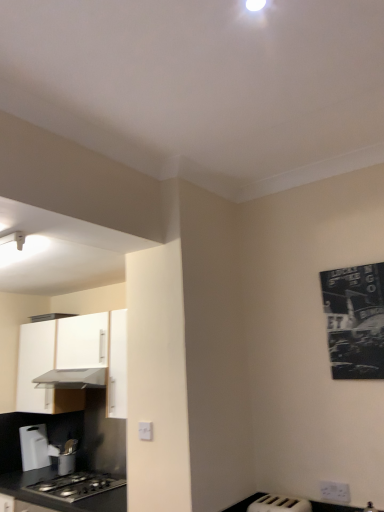
Question: From the image's perspective, is white plastic toaster at lower right, the 2th appliance from the back, positioned above or below white plastic electric outlet at lower right, the first electric outlet in the right-to-left sequence?

Choices:
 (A) above
 (B) below

Answer: (B)

Question: From a real-world perspective, relative to white plastic electric outlet at lower right, which appears as the 2th electric outlet when viewed from the left, is white plastic toaster at lower right, the 1th appliance viewed from the top, vertically above or below?

Choices:
 (A) below
 (B) above

Answer: (A)

Question: Considering the real-world distances, which object is farthest from the black matte countertop at lower left?

Choices:
 (A) white plastic electric outlet at lower right, which is the 1th electric outlet in bottom-to-top order
 (B) metallic silver utensil holder at lower left, which ranks as the 1th appliance in left-to-right order
 (C) white matte cabinet at left
 (D) metallic gray exhaust hood at left
 (E) white plastic electric outlet at lower center, arranged as the 1th electric outlet when viewed from the top

Answer: (A)

Question: Estimate the real-world distances between objects in this image. Which object is closer to the metallic gray exhaust hood at left?

Choices:
 (A) white plastic electric outlet at lower right, which is the 1th electric outlet in bottom-to-top order
 (B) black matte countertop at lower left
 (C) black paper poster at upper right
 (D) white plastic electric outlet at lower center, which ranks as the 2th electric outlet in bottom-to-top order
 (E) metallic silver utensil holder at lower left, the first appliance in the bottom-to-top sequence

Answer: (E)